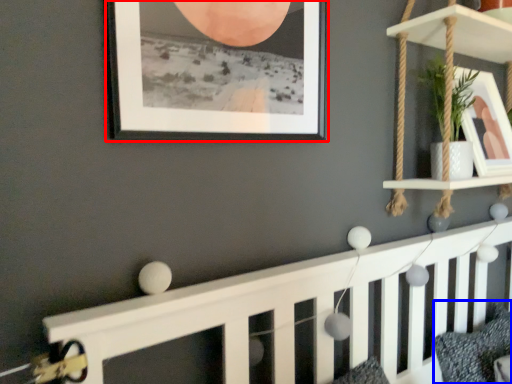
Question: Which object appears closest to the camera in this image, picture frame (highlighted by a red box) or pillow (highlighted by a blue box)?

Choices:
 (A) picture frame
 (B) pillow

Answer: (A)